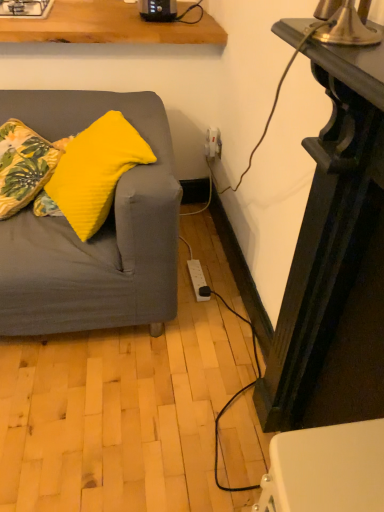
What are the coordinates of `black plastic toaster at upper center` in the screenshot? It's located at (158, 10).

This screenshot has height=512, width=384. What are the coordinates of `white glossy gas stove at upper left` in the screenshot? It's located at (25, 8).

Identify the location of yellow fabric pillow at left, which appears as the 2th pillow when viewed from the left. (96, 170).

Considering the sizes of objects yellow fabric pillow at left, marked as the 2th pillow in a right-to-left arrangement, and yellow fabric pillow at left, which appears as the 2th pillow when viewed from the left, in the image provided, who is smaller, yellow fabric pillow at left, marked as the 2th pillow in a right-to-left arrangement, or yellow fabric pillow at left, which appears as the 2th pillow when viewed from the left,?

Smaller between the two is yellow fabric pillow at left, marked as the 2th pillow in a right-to-left arrangement.

How much distance is there between yellow fabric pillow at left, marked as the 1th pillow in a left-to-right arrangement, and yellow fabric pillow at left, the 1th pillow when ordered from right to left?

The distance of yellow fabric pillow at left, marked as the 1th pillow in a left-to-right arrangement, from yellow fabric pillow at left, the 1th pillow when ordered from right to left, is 8.22 inches.

Based on the photo, is there a large distance between yellow fabric pillow at left, marked as the 1th pillow in a left-to-right arrangement, and yellow fabric pillow at left, the 1th pillow when ordered from right to left?

That's not correct — yellow fabric pillow at left, marked as the 1th pillow in a left-to-right arrangement, is a little close to yellow fabric pillow at left, the 1th pillow when ordered from right to left.

Is point (5, 170) farther from viewer compared to point (81, 152)?

Yes, point (5, 170) is farther from viewer.

Can you confirm if white glossy gas stove at upper left is smaller than black glossy table at right?

Correct, white glossy gas stove at upper left occupies less space than black glossy table at right.

Looking at their sizes, would you say white glossy gas stove at upper left is wider or thinner than black glossy table at right?

Clearly, white glossy gas stove at upper left has more width compared to black glossy table at right.

Who is more distant, white glossy gas stove at upper left or black glossy table at right?

white glossy gas stove at upper left is further away from the camera.

Locate an element on the screen. table that is below the white glossy gas stove at upper left (from the image's perspective) is located at coordinates click(x=333, y=255).

Measure the distance from white glossy gas stove at upper left to yellow fabric pillow at left, marked as the 2th pillow in a right-to-left arrangement.

white glossy gas stove at upper left and yellow fabric pillow at left, marked as the 2th pillow in a right-to-left arrangement, are 65.16 centimeters apart from each other.

Is white glossy gas stove at upper left not within yellow fabric pillow at left, marked as the 1th pillow in a left-to-right arrangement?

white glossy gas stove at upper left is positioned outside yellow fabric pillow at left, marked as the 1th pillow in a left-to-right arrangement.

Can you confirm if white glossy gas stove at upper left is wider than yellow fabric pillow at left, marked as the 2th pillow in a right-to-left arrangement?

Correct, the width of white glossy gas stove at upper left exceeds that of yellow fabric pillow at left, marked as the 2th pillow in a right-to-left arrangement.

Is white glossy gas stove at upper left positioned with its back to yellow fabric pillow at left, marked as the 1th pillow in a left-to-right arrangement?

No, yellow fabric pillow at left, marked as the 1th pillow in a left-to-right arrangement, is not at the back of white glossy gas stove at upper left.

Does point (144, 151) come farther from viewer compared to point (45, 0)?

That is False.

Find the location of `gas stove behind the yellow fabric pillow at left, the 1th pillow when ordered from right to left`. gas stove behind the yellow fabric pillow at left, the 1th pillow when ordered from right to left is located at coordinates (25, 8).

How much distance is there between yellow fabric pillow at left, the 1th pillow when ordered from right to left, and white glossy gas stove at upper left?

yellow fabric pillow at left, the 1th pillow when ordered from right to left, and white glossy gas stove at upper left are 33.96 inches apart.

Can you see yellow fabric pillow at left, which appears as the 2th pillow when viewed from the left, touching white glossy gas stove at upper left?

No, yellow fabric pillow at left, which appears as the 2th pillow when viewed from the left, is not making contact with white glossy gas stove at upper left.

Is yellow fabric pillow at left, marked as the 1th pillow in a left-to-right arrangement, positioned with its back to black glossy table at right?

yellow fabric pillow at left, marked as the 1th pillow in a left-to-right arrangement, does not have its back to black glossy table at right.

From the image's perspective, does yellow fabric pillow at left, marked as the 1th pillow in a left-to-right arrangement, appear lower than black glossy table at right?

No.

From a real-world perspective, between yellow fabric pillow at left, marked as the 1th pillow in a left-to-right arrangement, and black glossy table at right, who is vertically higher?

black glossy table at right.

Is yellow fabric pillow at left, marked as the 1th pillow in a left-to-right arrangement, positioned behind black glossy table at right?

Yes, it is.

Which is behind, point (328, 192) or point (148, 12)?

Positioned behind is point (148, 12).

Can you confirm if black glossy table at right is taller than black plastic toaster at upper center?

Yes, black glossy table at right is taller than black plastic toaster at upper center.

Considering the sizes of objects black glossy table at right and black plastic toaster at upper center in the image provided, who is bigger, black glossy table at right or black plastic toaster at upper center?

With larger size is black glossy table at right.

From the picture: From the image's perspective, between black glossy table at right and black plastic toaster at upper center, who is located below?

black glossy table at right.

Can you confirm if black plastic toaster at upper center is bigger than yellow fabric pillow at left, marked as the 1th pillow in a left-to-right arrangement?

Incorrect, black plastic toaster at upper center is not larger than yellow fabric pillow at left, marked as the 1th pillow in a left-to-right arrangement.

Based on the photo, can you confirm if black plastic toaster at upper center is shorter than yellow fabric pillow at left, marked as the 2th pillow in a right-to-left arrangement?

Correct, black plastic toaster at upper center is not as tall as yellow fabric pillow at left, marked as the 2th pillow in a right-to-left arrangement.

Considering the relative positions of black plastic toaster at upper center and yellow fabric pillow at left, marked as the 2th pillow in a right-to-left arrangement, in the image provided, is black plastic toaster at upper center behind yellow fabric pillow at left, marked as the 2th pillow in a right-to-left arrangement,?

Yes, it is.

Is point (165, 16) positioned in front of point (51, 162)?

No.

You are a GUI agent. You are given a task and a screenshot of the screen. Output one action in this format:
    pyautogui.click(x=<x>, y=<y>)
    Task: Click on the pillow that is above the yellow fabric pillow at left, marked as the 2th pillow in a right-to-left arrangement (from a real-world perspective)
    
    Given the screenshot: What is the action you would take?
    pyautogui.click(x=96, y=170)

At what (x,y) coordinates should I click in order to perform the action: click on table located underneath the white glossy gas stove at upper left (from a real-world perspective). Please return your answer as a coordinate pair (x, y). This screenshot has width=384, height=512. Looking at the image, I should click on (333, 255).

Looking at the image, which one is located closer to yellow fabric pillow at left, the 1th pillow when ordered from right to left, black plastic toaster at upper center or white glossy gas stove at upper left?

Based on the image, black plastic toaster at upper center appears to be nearer to yellow fabric pillow at left, the 1th pillow when ordered from right to left.

In the scene shown: Based on their spatial positions, is yellow fabric pillow at left, marked as the 1th pillow in a left-to-right arrangement, or yellow fabric pillow at left, the 1th pillow when ordered from right to left, closer to black plastic toaster at upper center?

yellow fabric pillow at left, marked as the 1th pillow in a left-to-right arrangement.

From the image, which object appears to be farther from black glossy table at right, yellow fabric pillow at left, which appears as the 2th pillow when viewed from the left, or yellow fabric pillow at left, marked as the 2th pillow in a right-to-left arrangement?

yellow fabric pillow at left, marked as the 2th pillow in a right-to-left arrangement, lies further to black glossy table at right than the other object.

Consider the image. Based on their spatial positions, is black glossy table at right or yellow fabric pillow at left, which appears as the 2th pillow when viewed from the left, further from yellow fabric pillow at left, marked as the 1th pillow in a left-to-right arrangement?

black glossy table at right is further to yellow fabric pillow at left, marked as the 1th pillow in a left-to-right arrangement.

Which object lies nearer to the anchor point black glossy table at right, yellow fabric pillow at left, which appears as the 2th pillow when viewed from the left, or black plastic toaster at upper center?

The object closer to black glossy table at right is yellow fabric pillow at left, which appears as the 2th pillow when viewed from the left.

In the scene shown: Estimate the real-world distances between objects in this image. Which object is closer to white glossy gas stove at upper left, black glossy table at right or black plastic toaster at upper center?

The object closer to white glossy gas stove at upper left is black plastic toaster at upper center.

From the image, which object appears to be farther from black glossy table at right, black plastic toaster at upper center or yellow fabric pillow at left, the 1th pillow when ordered from right to left?

black plastic toaster at upper center is positioned further to the anchor black glossy table at right.

Looking at this image, which object lies further to the anchor point yellow fabric pillow at left, the 1th pillow when ordered from right to left, black glossy table at right or black plastic toaster at upper center?

Based on the image, black plastic toaster at upper center appears to be further to yellow fabric pillow at left, the 1th pillow when ordered from right to left.

Where is `pillow between white glossy gas stove at upper left and yellow fabric pillow at left, which appears as the 2th pillow when viewed from the left, vertically`? pillow between white glossy gas stove at upper left and yellow fabric pillow at left, which appears as the 2th pillow when viewed from the left, vertically is located at coordinates (23, 165).

Image resolution: width=384 pixels, height=512 pixels. What are the coordinates of `appliance between white glossy gas stove at upper left and yellow fabric pillow at left, which appears as the 2th pillow when viewed from the left, in the vertical direction` in the screenshot? It's located at (158, 10).

You are a GUI agent. You are given a task and a screenshot of the screen. Output one action in this format:
    pyautogui.click(x=<x>, y=<y>)
    Task: Click on the appliance that lies between white glossy gas stove at upper left and yellow fabric pillow at left, marked as the 2th pillow in a right-to-left arrangement, from top to bottom
    
    Given the screenshot: What is the action you would take?
    pyautogui.click(x=158, y=10)

Where is `gas stove between black glossy table at right and black plastic toaster at upper center along the z-axis`? The height and width of the screenshot is (512, 384). gas stove between black glossy table at right and black plastic toaster at upper center along the z-axis is located at coordinates (25, 8).